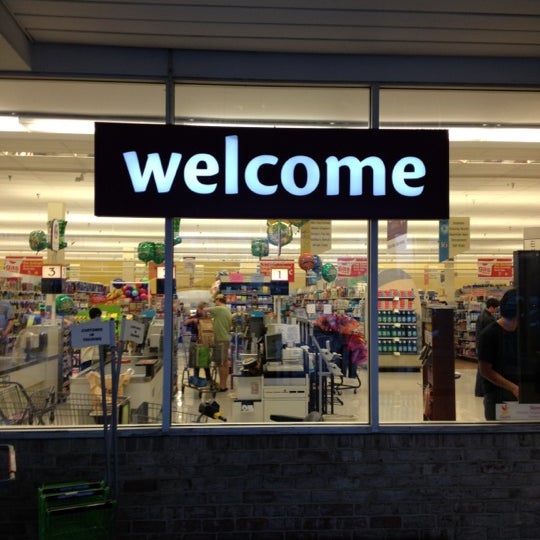
This screenshot has width=540, height=540. Find the location of `display`. display is located at coordinates (401, 291), (402, 303), (398, 318), (399, 329), (407, 347).